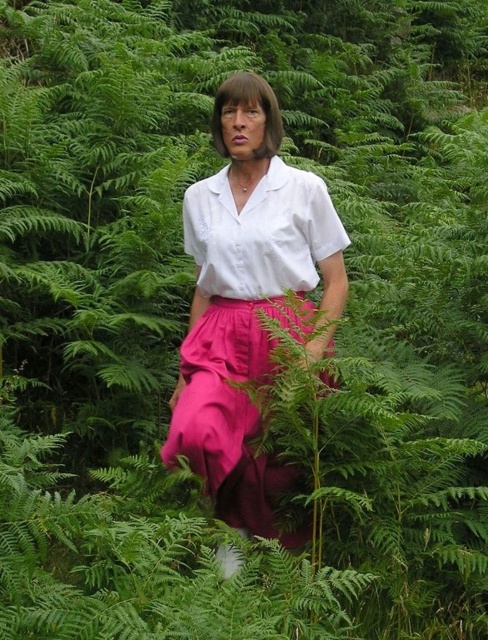
You are an artist sketching the scene. You need to position the matte pink fabric skirt at center accurately. What are the coordinates where you should place it?

The coordinates for the matte pink fabric skirt at center are at point (x=231, y=413).

You are taking a photo of the person in the scene. You want to focus on the point closer to the camera. Which point should you choose between point (167, 435) and point (333, 225)?

Point (167, 435) is further to the camera than point (333, 225), so you should choose point (167, 435) to focus on the closer point.

You are a photographer setting up a shoot in the scene described. You need to position a spotlight to the left of the matte pink skirt at center and another to the right of the matte pink fabric skirt at center. Will the two spotlights end up in the same location?

The matte pink skirt at center is to the right of the matte pink fabric skirt at center. Placing a spotlight to the left of the matte pink skirt at center and another to the right of the matte pink fabric skirt at center would result in the two spotlights being in the same location because the first spotlight is positioned to the left of the skirt that is already right of the other skirt, making their left and right positions overlap.